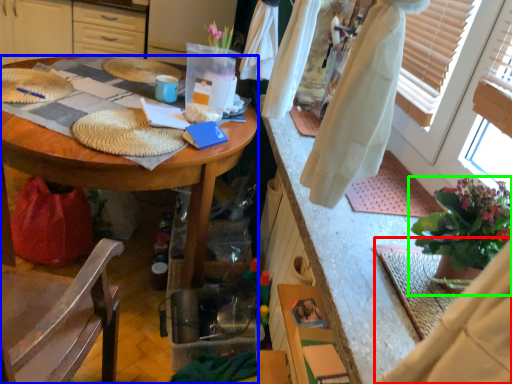
Question: Estimate the real-world distances between objects in this image. Which object is closer to robe (highlighted by a red box), desk (highlighted by a blue box) or houseplant (highlighted by a green box)?

Choices:
 (A) desk
 (B) houseplant

Answer: (B)